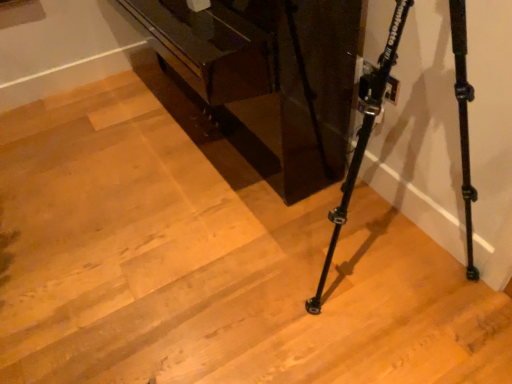
Locate an element on the screen. vacant space situated on the left part of black matte tripod at lower right is located at coordinates (208, 298).